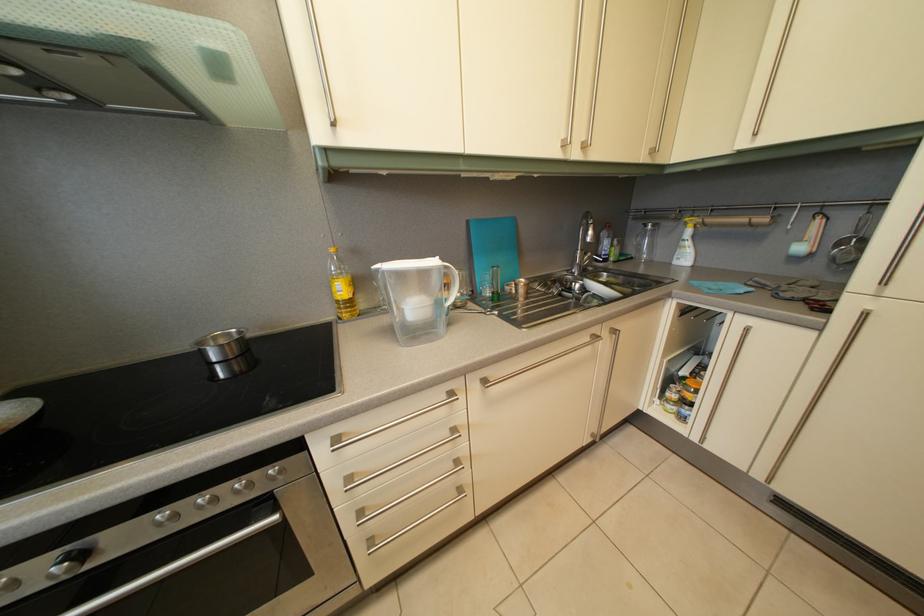
This screenshot has height=616, width=924. I want to click on spray bottle trigger, so click(686, 244).